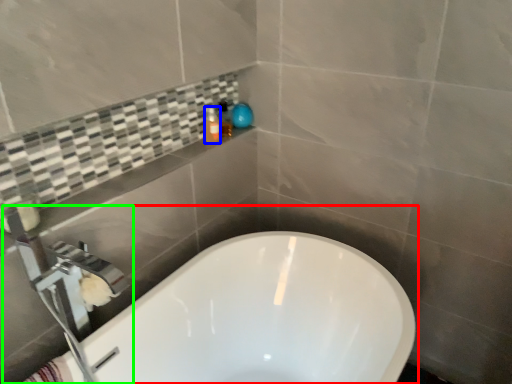
Question: Estimate the real-world distances between objects in this image. Which object is farther from bathtub (highlighted by a red box), toiletry (highlighted by a blue box) or tap (highlighted by a green box)?

Choices:
 (A) toiletry
 (B) tap

Answer: (A)